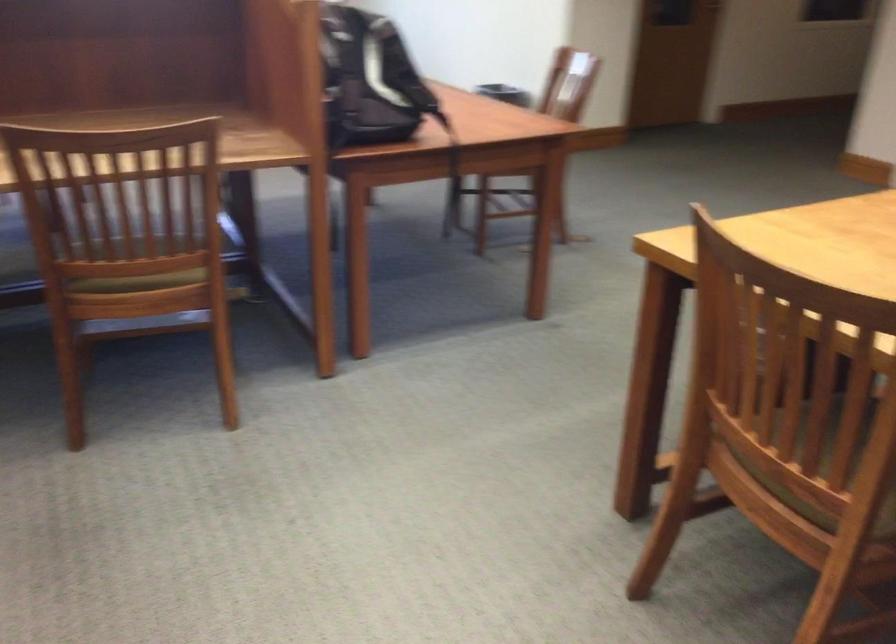
You are a GUI agent. You are given a task and a screenshot of the screen. Output one action in this format:
    pyautogui.click(x=<x>, y=<y>)
    Task: Click on the black trash can
    The image size is (896, 644).
    Given the screenshot: What is the action you would take?
    pyautogui.click(x=504, y=93)